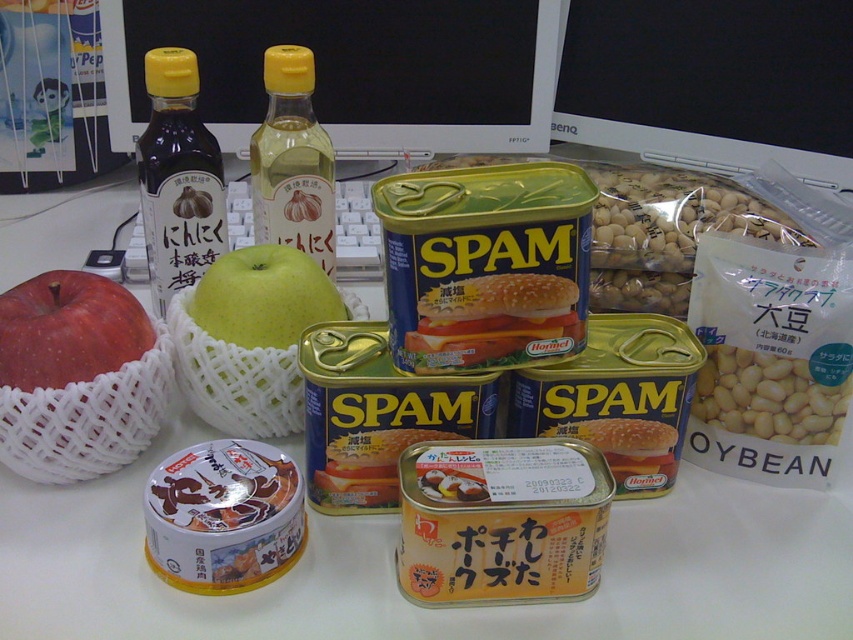
Which is behind, point (10, 384) or point (241, 284)?

Point (241, 284)

Describe the element at coordinates (68, 330) in the screenshot. I see `red matte apple at left` at that location.

Is point (78, 352) more distant than point (293, 337)?

No.

At what (x,y) coordinates should I click in order to perform the action: click on red matte apple at left. Please return your answer as a coordinate pair (x, y). Image resolution: width=853 pixels, height=640 pixels. Looking at the image, I should click on (68, 330).

Is point (352, 106) closer to viewer compared to point (787, 161)?

No, it is behind (787, 161).

Between point (141, 81) and point (701, 83), which one is positioned in front?

Point (141, 81) is in front.

Which is behind, point (552, 80) or point (735, 129)?

The point (552, 80) is more distant.

Find the location of a particular element. matte black monitor at upper center is located at coordinates (351, 68).

Where is `matte black monitor at upper center`? matte black monitor at upper center is located at coordinates (351, 68).

Between matte black monitor at upper center and white matte soybeans at right, which one appears on the left side from the viewer's perspective?

matte black monitor at upper center

What do you see at coordinates (351, 68) in the screenshot? I see `matte black monitor at upper center` at bounding box center [351, 68].

Find the location of a particular element. This screenshot has height=640, width=853. matte black monitor at upper center is located at coordinates (351, 68).